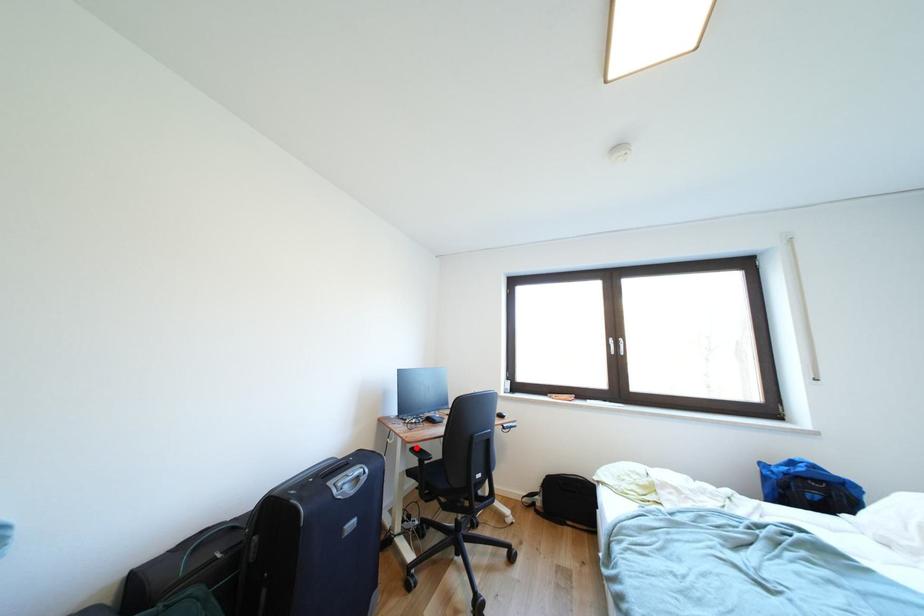
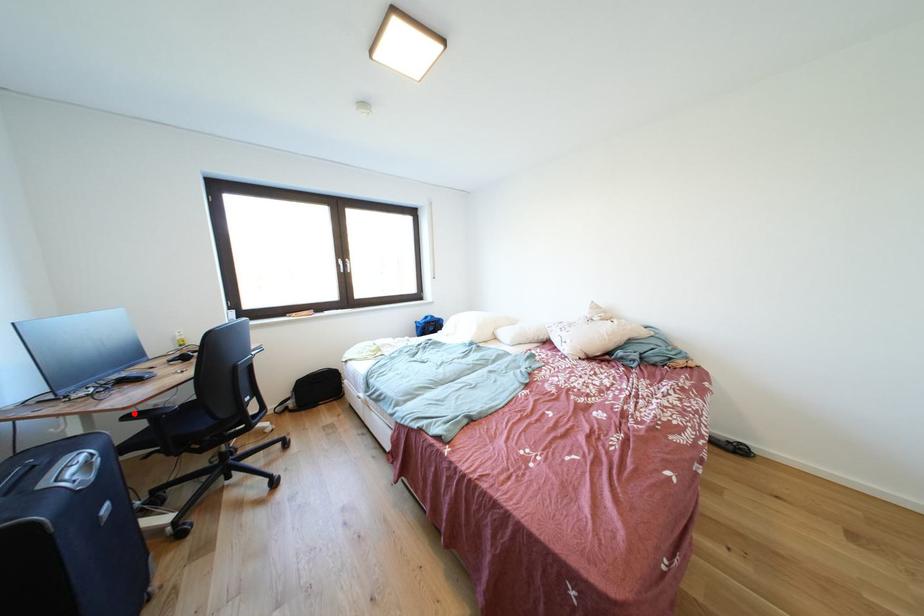
I am providing you with two images of the same scene from different viewpoints. A red point is marked on the first image and another point is marked on the second image. Is the marked point in image1 the same physical position as the marked point in image2?

Yes